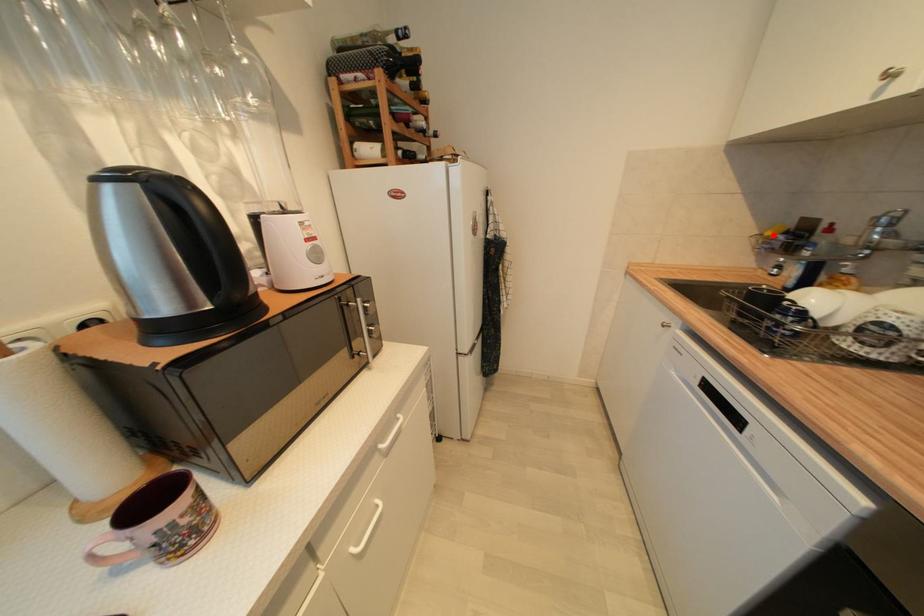
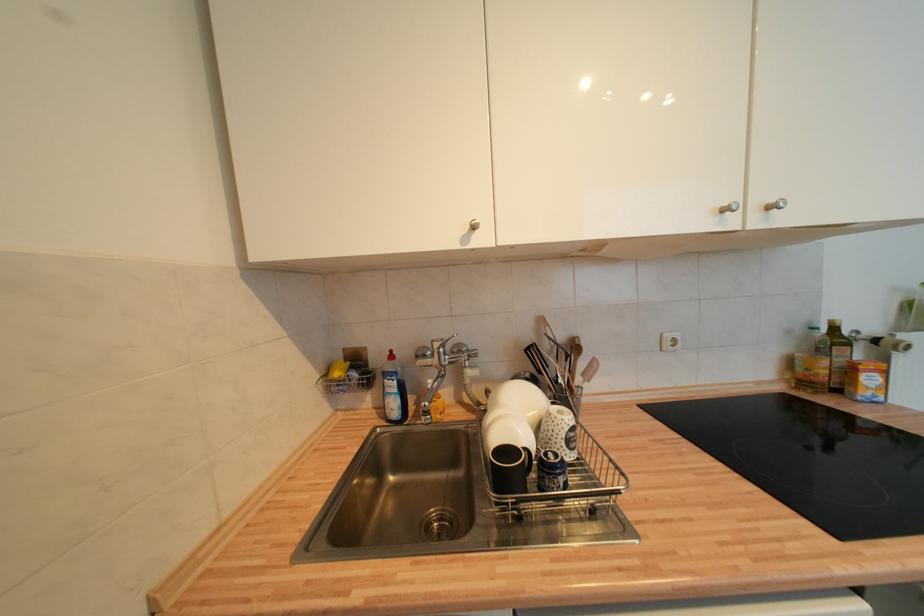
Where in the second image is the point corresponding to the highlighted location from the first image?

(343, 376)